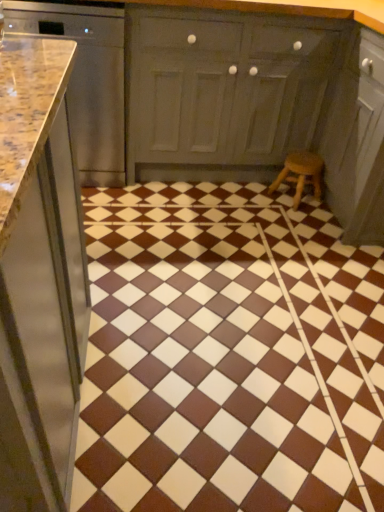
I want to click on free point to the left of wooden stool at lower right, so click(x=258, y=195).